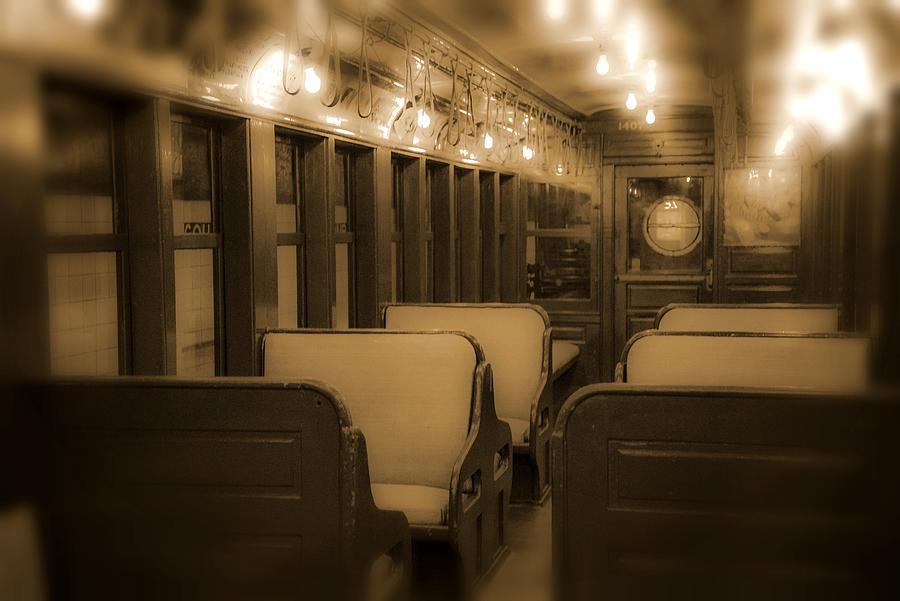
Find the location of `lightbulbs`. lightbulbs is located at coordinates (648, 111), (599, 68), (630, 97), (650, 78), (420, 119), (308, 83), (486, 139), (526, 151).